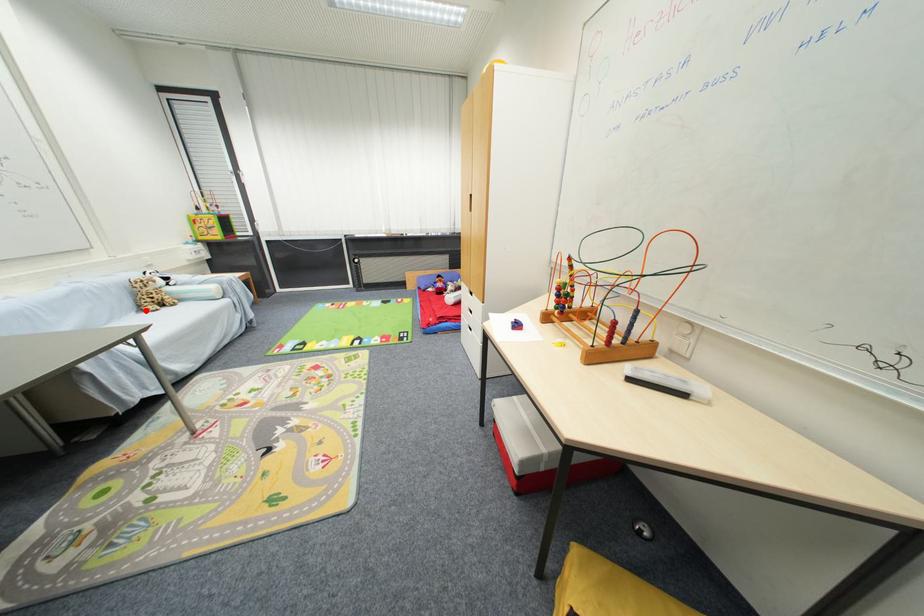
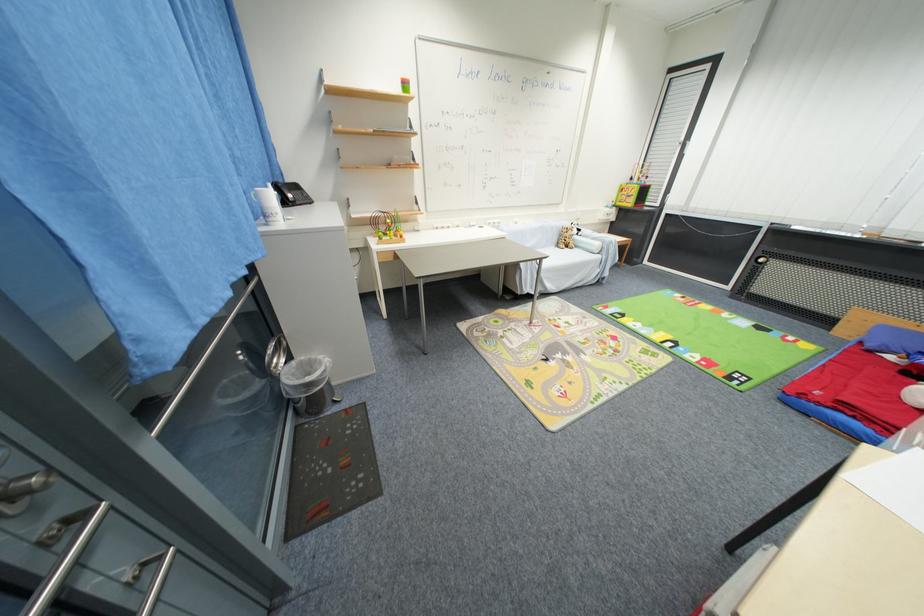
Question: I am providing you with two images of the same scene from different viewpoints. Image1 has a red point marked. In image2, the corresponding 3D location appears at what relative position? Reply with the corresponding letter.

Choices:
 (A) Closer
 (B) Farther

Answer: (B)